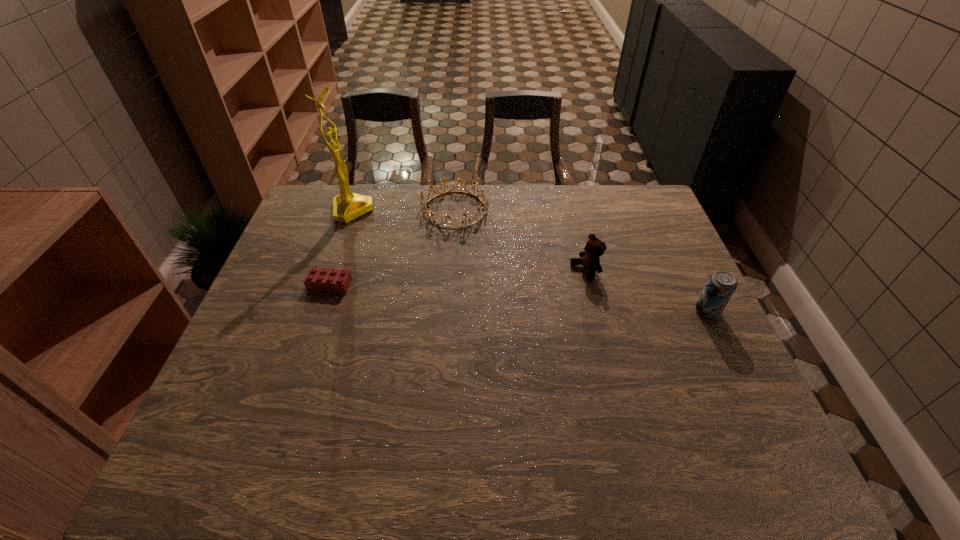
You are a GUI agent. You are given a task and a screenshot of the screen. Output one action in this format:
    pyautogui.click(x=<x>, y=<y>)
    Task: Click on the Lego positioned at the left edge
    This screenshot has width=960, height=540.
    Given the screenshot: What is the action you would take?
    pyautogui.click(x=318, y=279)

I want to click on award present at the left edge, so click(x=347, y=206).

At what (x,y) coordinates should I click in order to perform the action: click on object at the right edge. Please return your answer as a coordinate pair (x, y). Looking at the image, I should click on tap(721, 285).

Image resolution: width=960 pixels, height=540 pixels. Identify the location of object at the far left corner. (347, 206).

Identify the location of vacant space at the far edge of the desktop. The height and width of the screenshot is (540, 960). (423, 194).

Where is `free space at the near edge of the desktop`? free space at the near edge of the desktop is located at coordinates (362, 409).

Identify the location of vacant space at the left edge of the desktop. This screenshot has width=960, height=540. (294, 248).

Find the location of `vacant region at the right edge of the desktop`. vacant region at the right edge of the desktop is located at coordinates (738, 383).

In the image, there is a desktop. Where is `vacant space at the far left corner`? Image resolution: width=960 pixels, height=540 pixels. vacant space at the far left corner is located at coordinates (332, 207).

The width and height of the screenshot is (960, 540). Identify the location of vacant space at the far right corner of the desktop. (614, 192).